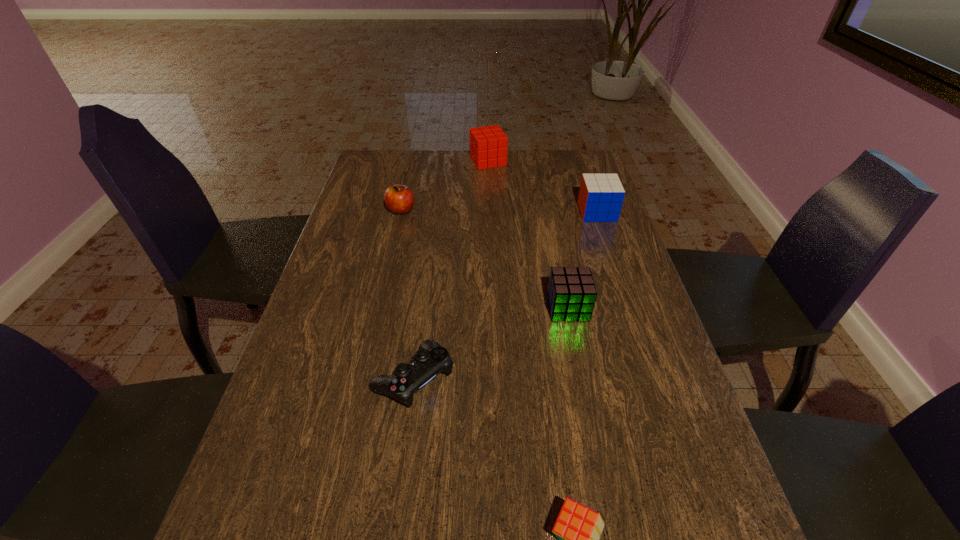
Where is `free space that satisfies the following two spatial constraints: 1. on the front side of the apple; 2. on the right side of the rightmost object`? Image resolution: width=960 pixels, height=540 pixels. free space that satisfies the following two spatial constraints: 1. on the front side of the apple; 2. on the right side of the rightmost object is located at coordinates (400, 212).